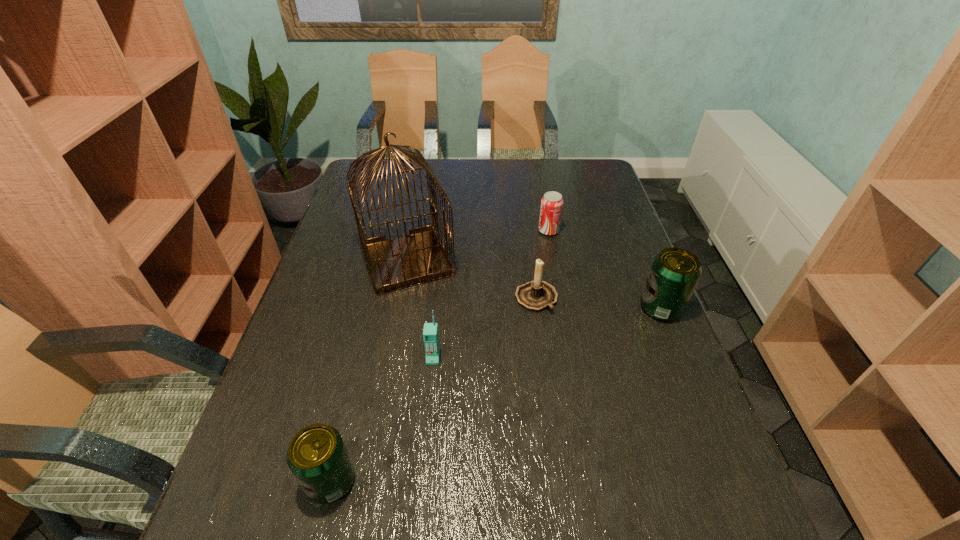
This screenshot has height=540, width=960. What are the coordinates of `object situated at the near left corner` in the screenshot? It's located at (317, 456).

Find the location of a particular element. The image size is (960, 540). free region at the far edge is located at coordinates (534, 179).

You are a GUI agent. You are given a task and a screenshot of the screen. Output one action in this format:
    pyautogui.click(x=<x>, y=<y>)
    Task: Click on the free location at the left edge
    The width and height of the screenshot is (960, 540).
    Given the screenshot: What is the action you would take?
    pyautogui.click(x=346, y=249)

In the image, there is a desktop. Identify the location of vacant space at the right edge. (608, 211).

In order to click on vacant space at the far left corner in this screenshot , I will do [x=377, y=187].

Identify the location of vacant space at the near left corner. 229,482.

At what (x,y) coordinates should I click in order to perform the action: click on blank space at the far right corner of the desktop. Please return your answer as a coordinate pair (x, y). The height and width of the screenshot is (540, 960). Looking at the image, I should click on (571, 183).

The height and width of the screenshot is (540, 960). Identify the location of free location at the near right corner. (670, 481).

I want to click on vacant point located between the birdcage and the soda can, so click(478, 246).

The width and height of the screenshot is (960, 540). I want to click on vacant space in between the candle holder and the left beer can, so click(x=434, y=389).